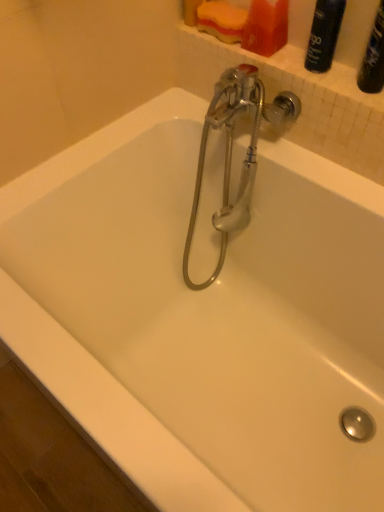
Question: From the image's perspective, is chrome metallic faucet at center located beneath matte plastic soap at upper center?

Choices:
 (A) yes
 (B) no

Answer: (A)

Question: Can you confirm if chrome metallic faucet at center is taller than matte plastic soap at upper center?

Choices:
 (A) no
 (B) yes

Answer: (B)

Question: Considering the relative sizes of chrome metallic faucet at center and matte plastic soap at upper center in the image provided, is chrome metallic faucet at center smaller than matte plastic soap at upper center?

Choices:
 (A) no
 (B) yes

Answer: (A)

Question: Does chrome metallic faucet at center appear on the left side of matte plastic soap at upper center?

Choices:
 (A) yes
 (B) no

Answer: (A)

Question: Does chrome metallic faucet at center touch matte plastic soap at upper center?

Choices:
 (A) no
 (B) yes

Answer: (A)

Question: Considering the positions of matte plastic soap at upper center and matte black spray can at upper right in the image, is matte plastic soap at upper center wider or thinner than matte black spray can at upper right?

Choices:
 (A) wide
 (B) thin

Answer: (A)

Question: From a real-world perspective, is matte plastic soap at upper center physically located above or below matte black spray can at upper right?

Choices:
 (A) below
 (B) above

Answer: (A)

Question: Considering the relative positions of matte plastic soap at upper center and matte black spray can at upper right in the image provided, is matte plastic soap at upper center to the left or to the right of matte black spray can at upper right?

Choices:
 (A) left
 (B) right

Answer: (A)

Question: Based on their sizes in the image, would you say matte plastic soap at upper center is bigger or smaller than matte black spray can at upper right?

Choices:
 (A) big
 (B) small

Answer: (B)

Question: Is point (324, 13) positioned closer to the camera than point (226, 136)?

Choices:
 (A) closer
 (B) farther

Answer: (A)

Question: Do you think matte black spray can at upper right is within chrome metallic faucet at center, or outside of it?

Choices:
 (A) outside
 (B) inside

Answer: (A)

Question: Considering the positions of matte black spray can at upper right and chrome metallic faucet at center in the image, is matte black spray can at upper right wider or thinner than chrome metallic faucet at center?

Choices:
 (A) wide
 (B) thin

Answer: (B)

Question: Is matte black spray can at upper right to the left or to the right of chrome metallic faucet at center in the image?

Choices:
 (A) left
 (B) right

Answer: (B)

Question: Based on their sizes in the image, would you say chrome metallic faucet at center is bigger or smaller than matte plastic soap at upper center?

Choices:
 (A) small
 (B) big

Answer: (B)

Question: Does point (246, 65) appear closer or farther from the camera than point (268, 49)?

Choices:
 (A) farther
 (B) closer

Answer: (A)